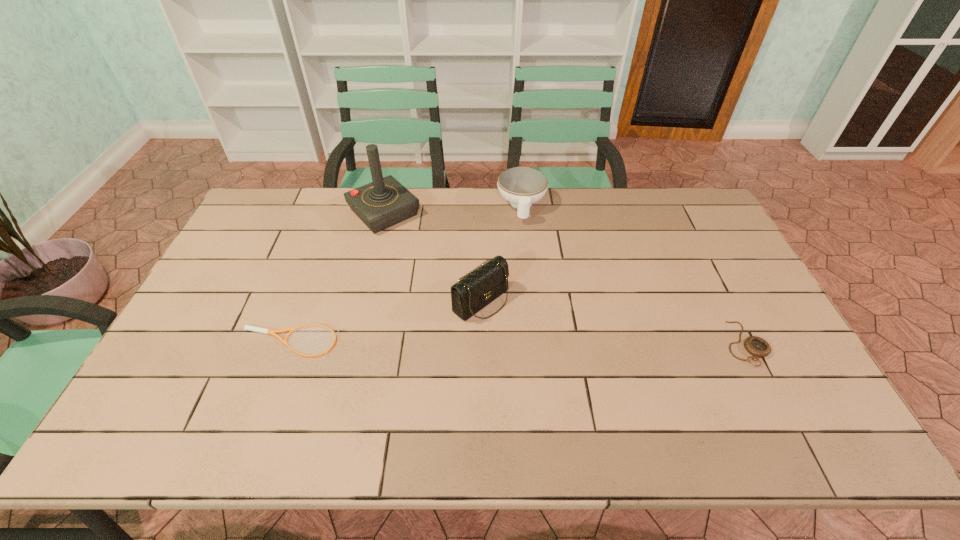
Locate an element on the screen. This screenshot has height=540, width=960. free point between the joystick and the pocket watch is located at coordinates (564, 278).

The height and width of the screenshot is (540, 960). Find the location of `vacant area that lies between the rightmost object and the third tallest object`. vacant area that lies between the rightmost object and the third tallest object is located at coordinates (634, 275).

At what (x,y) coordinates should I click in order to perform the action: click on vacant space that's between the shortest object and the tallest object. Please return your answer as a coordinate pair (x, y). The height and width of the screenshot is (540, 960). Looking at the image, I should click on (336, 278).

You are a GUI agent. You are given a task and a screenshot of the screen. Output one action in this format:
    pyautogui.click(x=<x>, y=<y>)
    Task: Click on the vacant space that is in between the third tallest object and the tallest object
    
    Given the screenshot: What is the action you would take?
    pyautogui.click(x=453, y=209)

What are the coordinates of `vacant region between the pocket watch and the tallest object` in the screenshot? It's located at (564, 278).

Identify which object is located as the nearest to the tallest object. Please provide its 2D coordinates. Your answer should be formatted as a tuple, i.e. [(x, y)], where the tuple contains the x and y coordinates of a point satisfying the conditions above.

[(474, 291)]

Where is `the closest object to the shortest object`? the closest object to the shortest object is located at coordinates (474, 291).